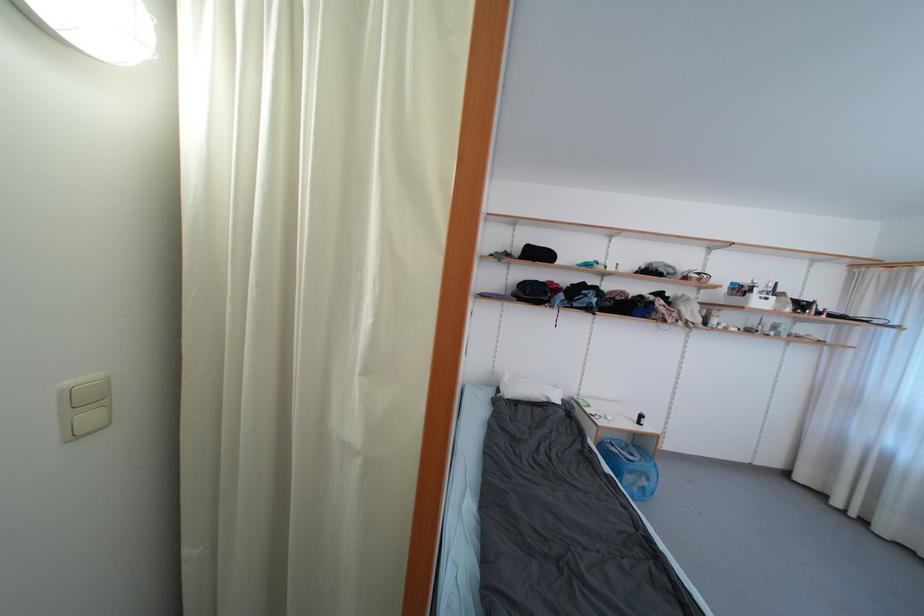
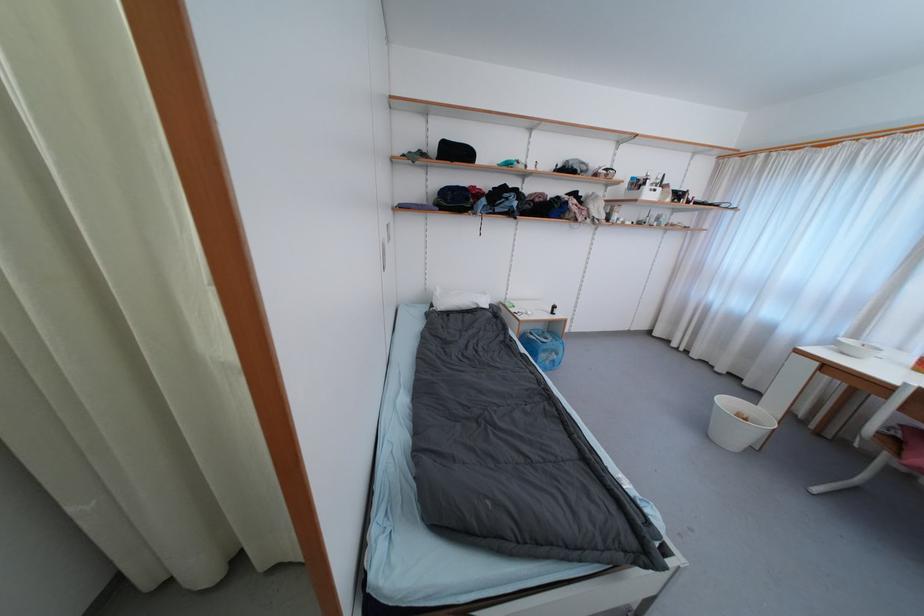
Where in the second image is the point corresponding to point 521,253 from the first image?

(438, 151)